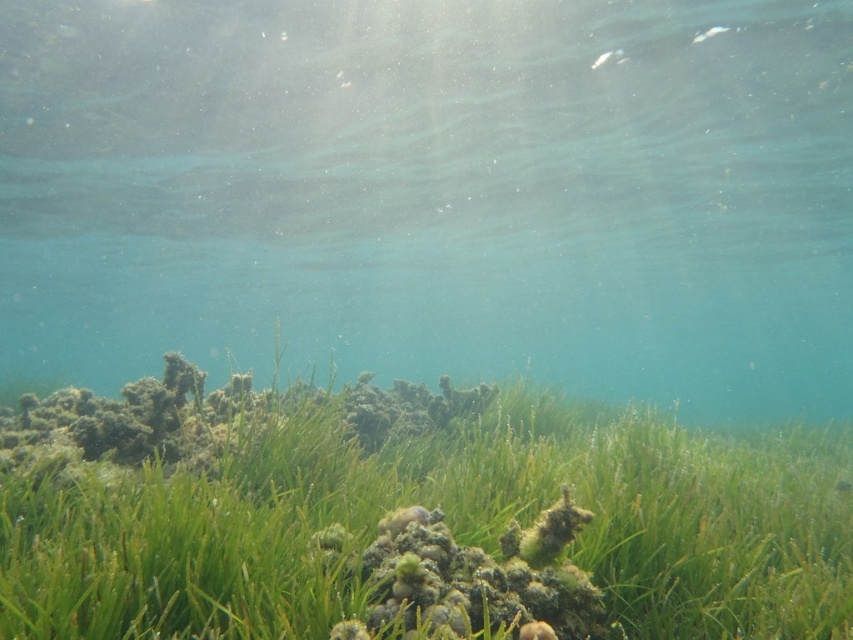
Question: Which point is closer to the camera?

Choices:
 (A) clear water at bottom
 (B) green matte grass at center

Answer: (B)

Question: Does clear water at bottom have a greater width compared to green matte grass at center?

Choices:
 (A) no
 (B) yes

Answer: (B)

Question: Which of the following is the closest to the observer?

Choices:
 (A) (222, 502)
 (B) (538, 120)

Answer: (A)

Question: In this image, where is clear water at bottom located relative to green matte grass at center?

Choices:
 (A) above
 (B) below

Answer: (B)

Question: Does clear water at bottom have a greater width compared to green matte grass at center?

Choices:
 (A) no
 (B) yes

Answer: (B)

Question: Which of the following is the farthest from the observer?

Choices:
 (A) green matte grass at center
 (B) clear water at bottom

Answer: (B)